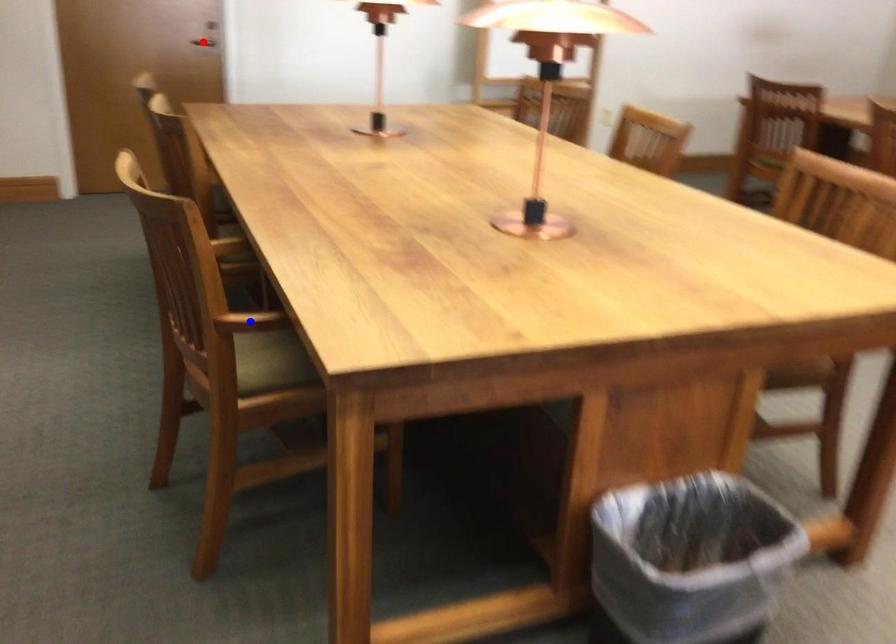
Question: Two points are marked on the image. Which point is closer to the camera?

Choices:
 (A) Blue point is closer.
 (B) Red point is closer.

Answer: (A)